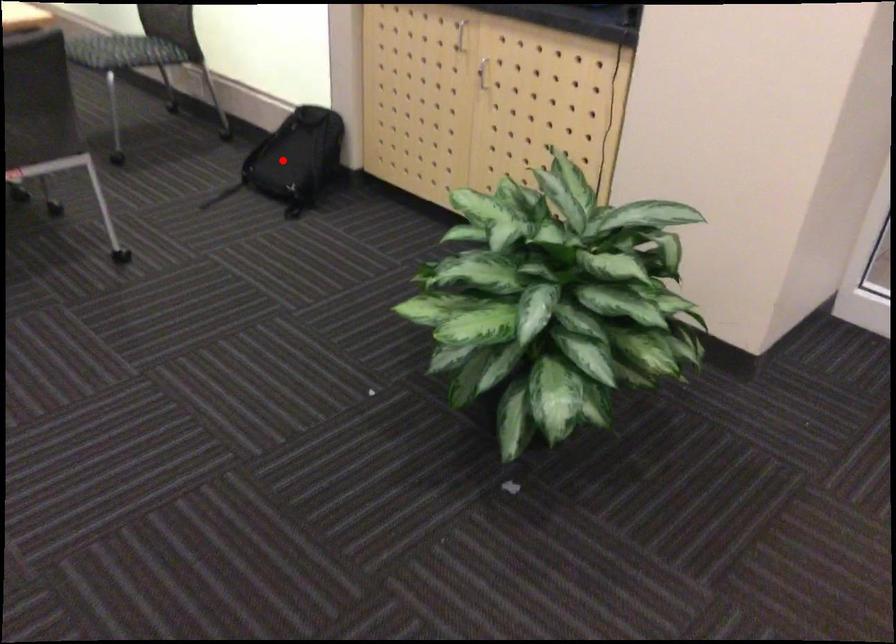
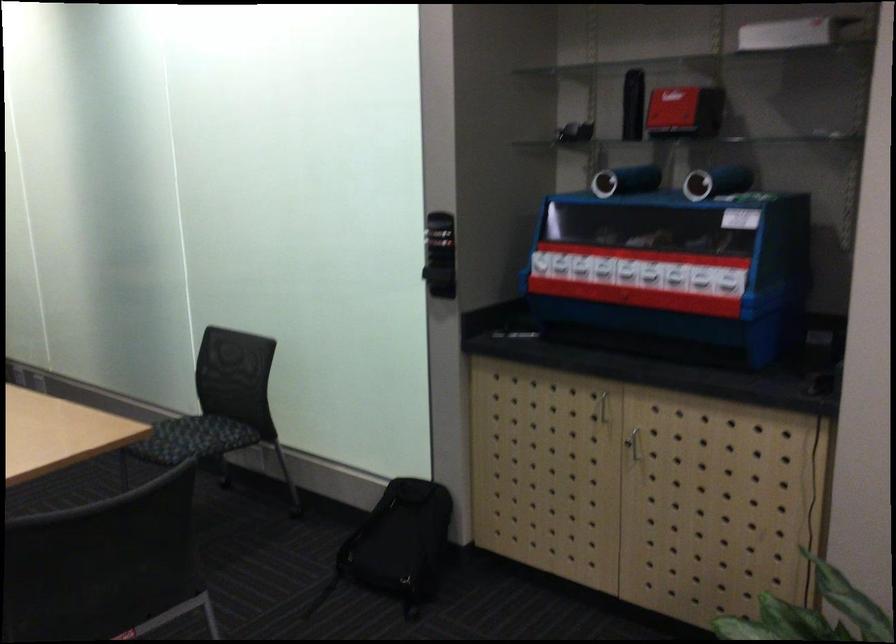
Question: I am providing you with two images of the same scene from different viewpoints. Given a red point in image1, look at the same physical point in image2. Is it:

Choices:
 (A) Closer to the viewpoint
 (B) Farther from the viewpoint

Answer: (A)